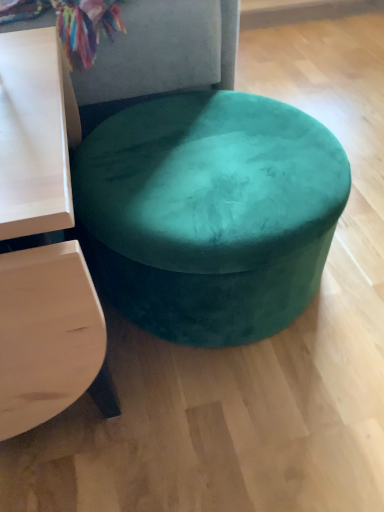
Question: From their relative heights in the image, would you say teal velvet ottoman at center is taller or shorter than matte white table at left?

Choices:
 (A) short
 (B) tall

Answer: (A)

Question: Considering the positions of teal velvet ottoman at center and matte white table at left in the image, is teal velvet ottoman at center bigger or smaller than matte white table at left?

Choices:
 (A) small
 (B) big

Answer: (B)

Question: Visually, is teal velvet ottoman at center positioned to the left or to the right of matte white table at left?

Choices:
 (A) left
 (B) right

Answer: (B)

Question: Does point (36, 170) appear closer or farther from the camera than point (258, 202)?

Choices:
 (A) closer
 (B) farther

Answer: (A)

Question: Considering their positions, is matte white table at left located in front of or behind teal velvet ottoman at center?

Choices:
 (A) behind
 (B) front

Answer: (B)

Question: In terms of height, does matte white table at left look taller or shorter compared to teal velvet ottoman at center?

Choices:
 (A) short
 (B) tall

Answer: (B)

Question: In terms of width, does matte white table at left look wider or thinner when compared to teal velvet ottoman at center?

Choices:
 (A) wide
 (B) thin

Answer: (A)